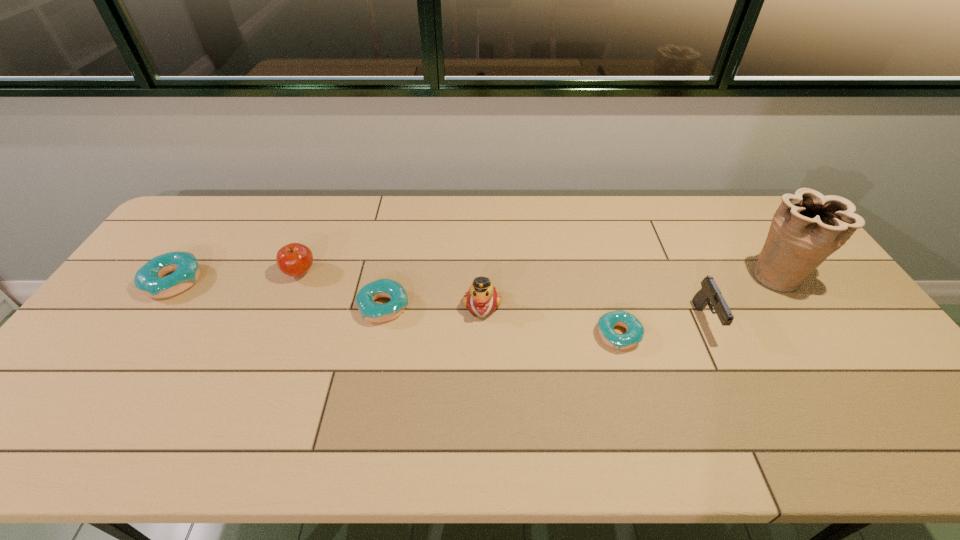
The height and width of the screenshot is (540, 960). I want to click on the leftmost object, so click(149, 278).

I want to click on the second doughnut from right to left, so click(375, 312).

You are a GUI agent. You are given a task and a screenshot of the screen. Output one action in this format:
    pyautogui.click(x=<x>, y=<y>)
    Task: Click on the fifth object from right to left
    
    Given the screenshot: What is the action you would take?
    pyautogui.click(x=375, y=312)

I want to click on the shortest object, so click(x=635, y=331).

Where is `the rightmost doughnut`? the rightmost doughnut is located at coordinates (635, 331).

This screenshot has height=540, width=960. I want to click on the tallest object, so coord(807,227).

You are a GUI agent. You are given a task and a screenshot of the screen. Output one action in this format:
    pyautogui.click(x=<x>, y=<y>)
    Task: Click on the rightmost object
    The height and width of the screenshot is (540, 960).
    Given the screenshot: What is the action you would take?
    pyautogui.click(x=807, y=227)

Where is `apple`? The height and width of the screenshot is (540, 960). apple is located at coordinates (294, 259).

This screenshot has width=960, height=540. I want to click on pistol, so click(709, 292).

Identify the location of duck. This screenshot has width=960, height=540. point(482,298).